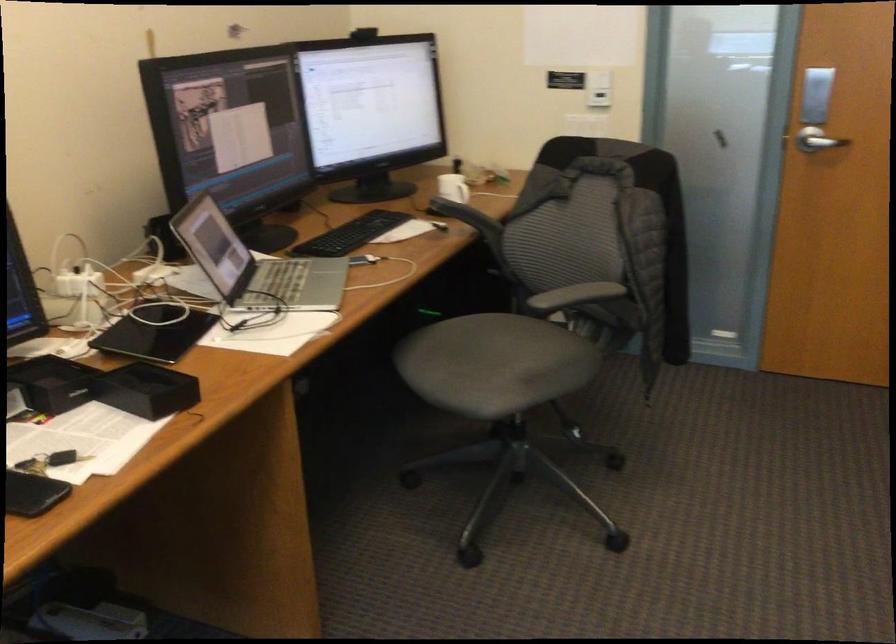
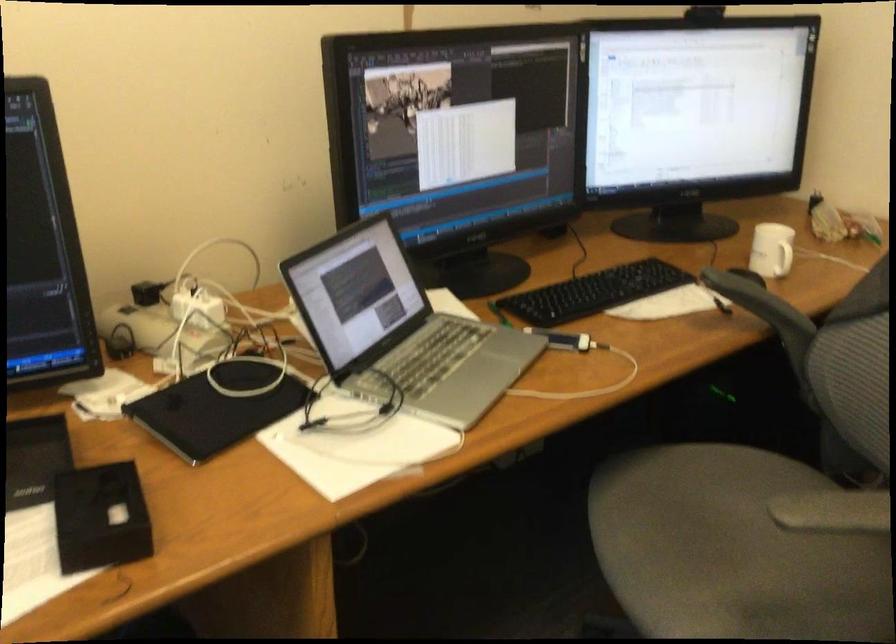
Find the pixel in the second image that matches point (468, 190) in the first image.

(782, 259)